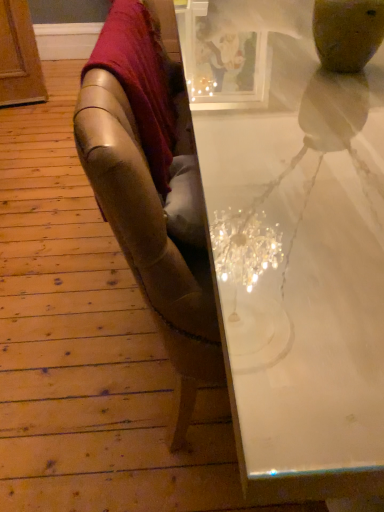
Question: From a real-world perspective, is velvet red blanket at upper left positioned over white glossy table at upper right based on gravity?

Choices:
 (A) yes
 (B) no

Answer: (A)

Question: Does velvet red blanket at upper left have a lesser width compared to white glossy table at upper right?

Choices:
 (A) yes
 (B) no

Answer: (A)

Question: Considering the relative sizes of velvet red blanket at upper left and white glossy table at upper right in the image provided, is velvet red blanket at upper left wider than white glossy table at upper right?

Choices:
 (A) yes
 (B) no

Answer: (B)

Question: Can we say velvet red blanket at upper left lies outside white glossy table at upper right?

Choices:
 (A) yes
 (B) no

Answer: (A)

Question: From the image's perspective, is velvet red blanket at upper left below white glossy table at upper right?

Choices:
 (A) no
 (B) yes

Answer: (A)

Question: Does velvet red blanket at upper left come behind white glossy table at upper right?

Choices:
 (A) no
 (B) yes

Answer: (B)

Question: From the image's perspective, does white glossy table at upper right appear higher than velvet red blanket at upper left?

Choices:
 (A) yes
 (B) no

Answer: (B)

Question: Would you say white glossy table at upper right contains velvet red blanket at upper left?

Choices:
 (A) yes
 (B) no

Answer: (B)

Question: Considering the relative positions of white glossy table at upper right and velvet red blanket at upper left in the image provided, is white glossy table at upper right to the left of velvet red blanket at upper left from the viewer's perspective?

Choices:
 (A) yes
 (B) no

Answer: (B)

Question: Is white glossy table at upper right bigger than velvet red blanket at upper left?

Choices:
 (A) no
 (B) yes

Answer: (B)

Question: Is white glossy table at upper right oriented away from velvet red blanket at upper left?

Choices:
 (A) yes
 (B) no

Answer: (B)

Question: Is the position of white glossy table at upper right less distant than that of velvet red blanket at upper left?

Choices:
 (A) no
 (B) yes

Answer: (B)

Question: From the image's perspective, is white glossy table at upper right above or below velvet red blanket at upper left?

Choices:
 (A) above
 (B) below

Answer: (B)